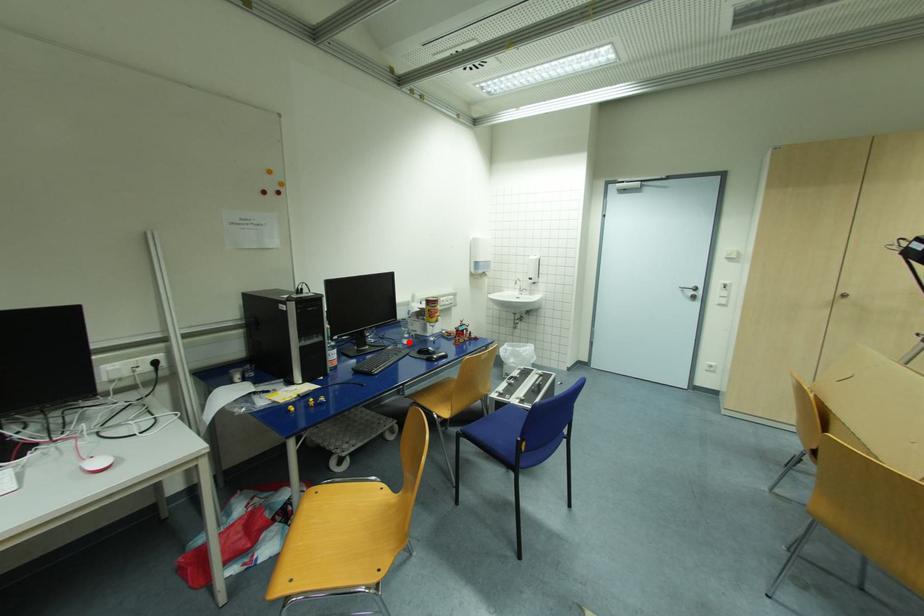
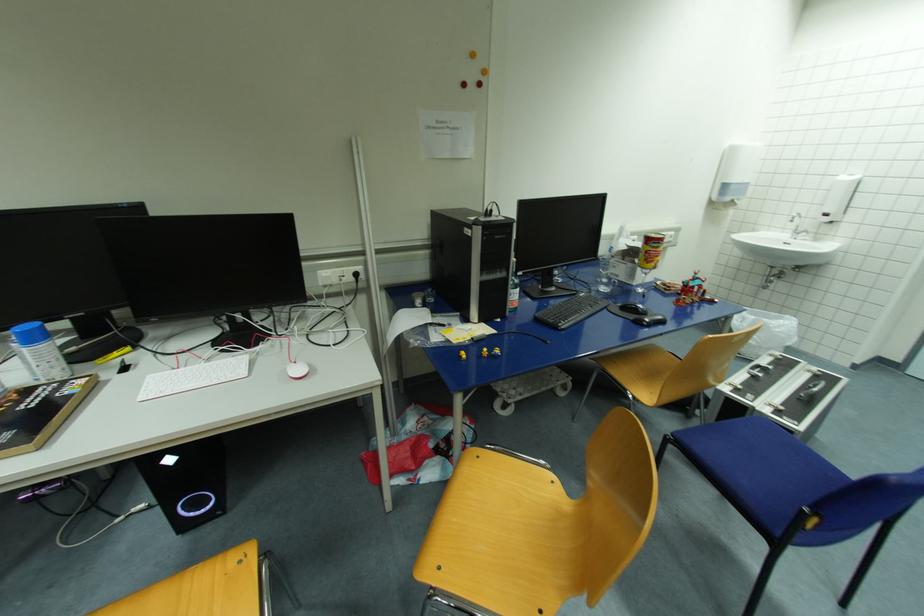
In the second image, find the point that corresponds to the highlighted location in the first image.

(605, 290)